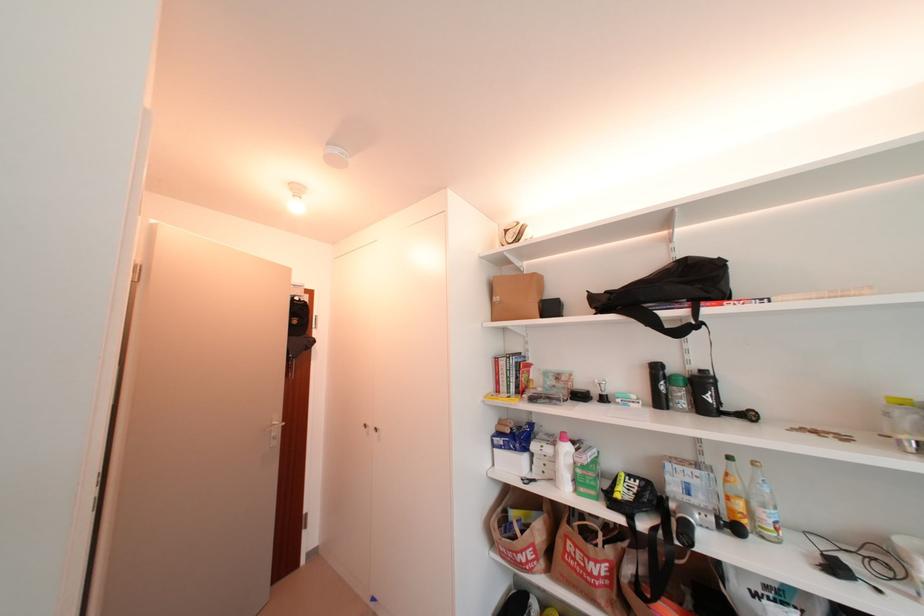
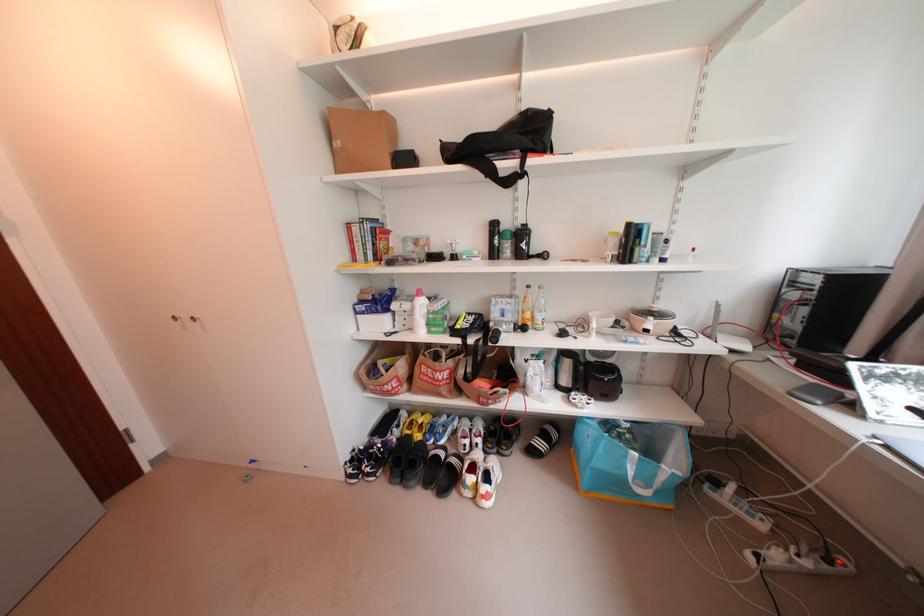
Find the pixel in the second image that matches point 648,403 in the first image.

(488, 257)